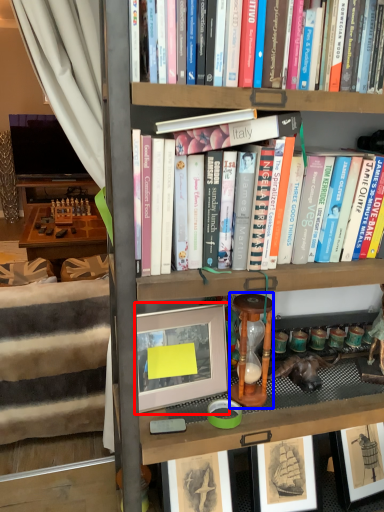
Question: Which object is further to the camera taking this photo, picture frame (highlighted by a red box) or stool (highlighted by a blue box)?

Choices:
 (A) picture frame
 (B) stool

Answer: (B)